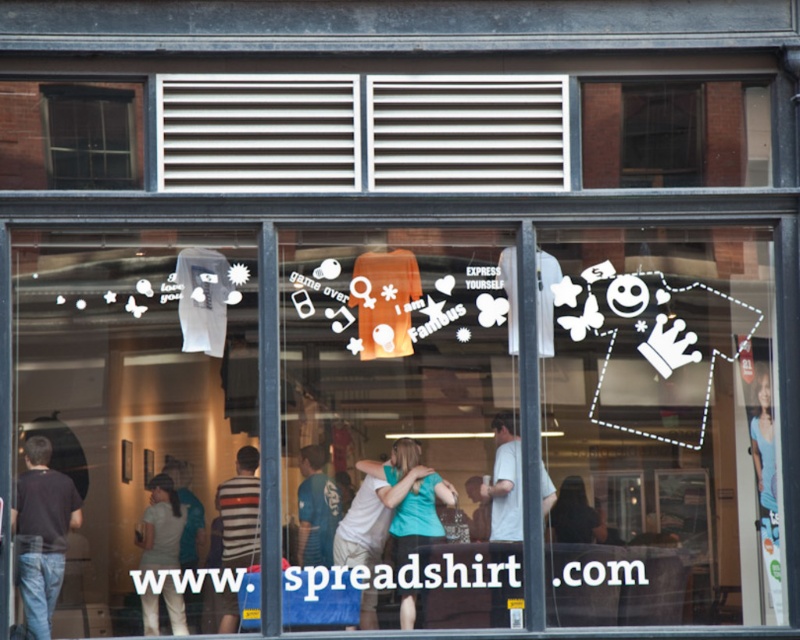
Based on the coordinates provided, which object corresponds to the point [42,532]?

The dark blue shirt at left corresponds to the point [42,532].

You are a customer standing in front of the Spreadshirt store window. You want to touch both the dark blue shirt at left and the dark blue shirt at center. If your arm can reach up to 1.5 meters, can you reach both shirts without moving your position?

The dark blue shirt at left and dark blue shirt at center are 1.59 meters apart. Since the distance between them is slightly more than your arm reach of 1.5 meters, you cannot reach both shirts without moving your position.

Where is the teal fabric shirt at center located in the image?

The teal fabric shirt at center is located at point (413,502).